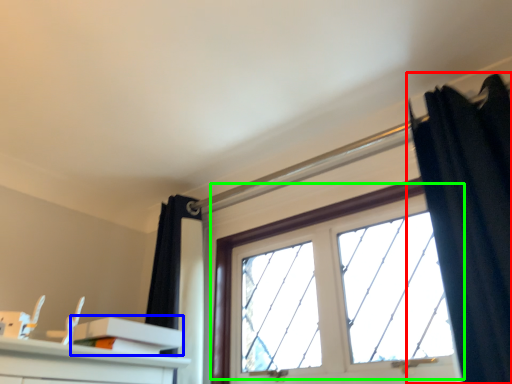
Question: Based on their relative distances, which object is nearer to curtain (highlighted by a red box)? Choose from shelf (highlighted by a blue box) and window (highlighted by a green box).

Choices:
 (A) shelf
 (B) window

Answer: (B)